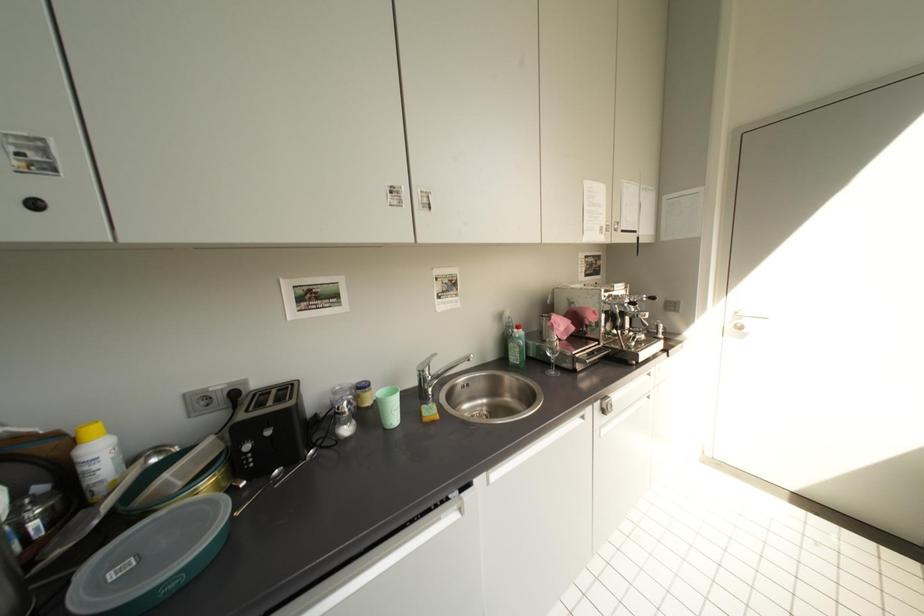
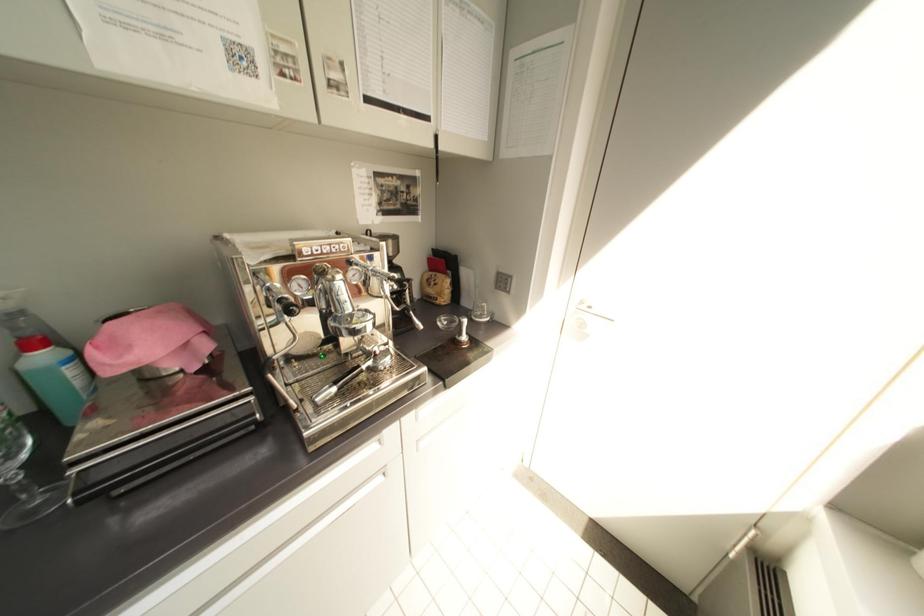
Which direction would the cameraman need to move to produce the second image?

The cameraman walked toward right, forward.